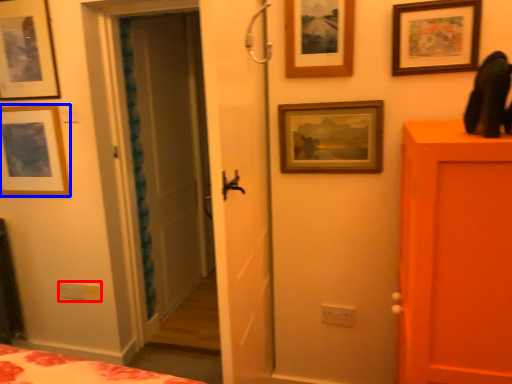
Question: Among these objects, which one is nearest to the camera, light switch (highlighted by a red box) or picture frame (highlighted by a blue box)?

Choices:
 (A) light switch
 (B) picture frame

Answer: (B)